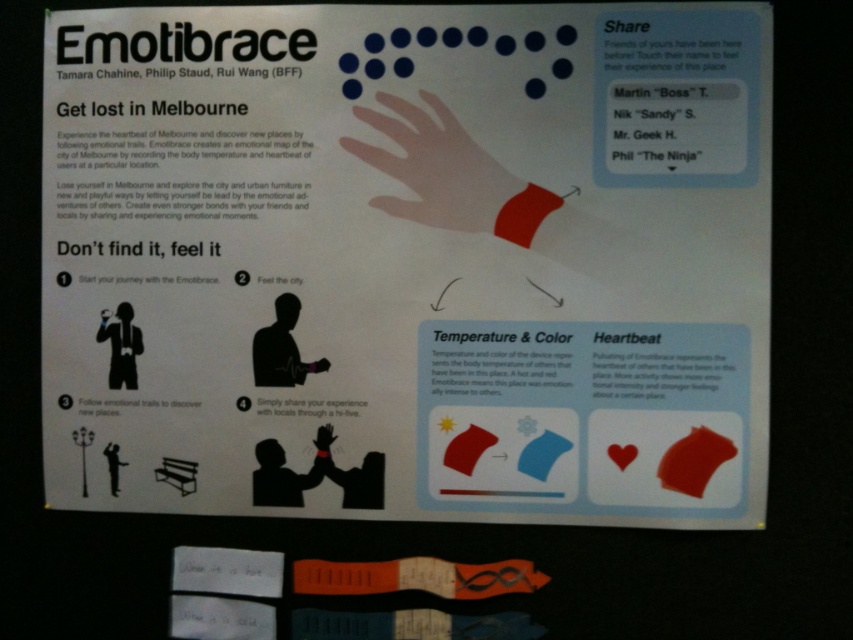
From the picture: Is white paper poster at upper center behind white matte hand at center?

No, it is in front of white matte hand at center.

Which is behind, point (300, 172) or point (426, 96)?

The point (300, 172) is behind.

You are a GUI agent. You are given a task and a screenshot of the screen. Output one action in this format:
    pyautogui.click(x=<x>, y=<y>)
    Task: Click on the white paper poster at upper center
    
    Given the screenshot: What is the action you would take?
    pyautogui.click(x=408, y=260)